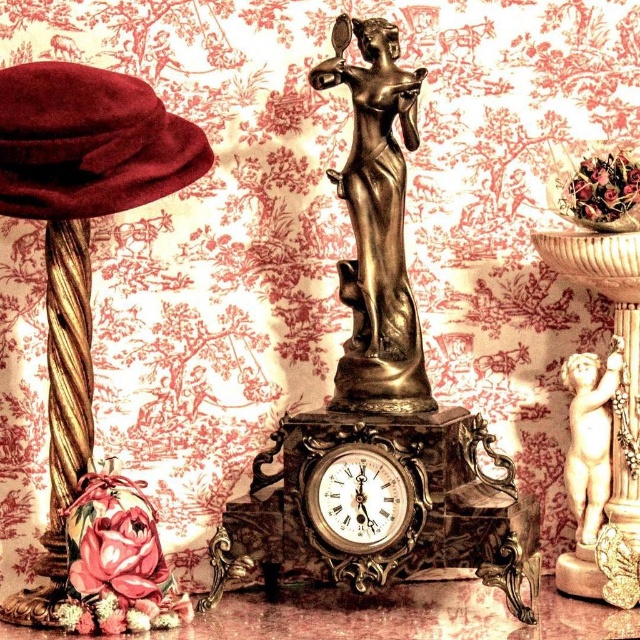
You are a decorator setting up a display. You have a velvet maroon hat at left and an ornate clock in the center. The display area is 1.5 meters wide. Can both items fit side by side without overlapping?

The velvet maroon hat at left and the ornate clock in the center are 1.38 meters apart, so yes, they can fit side by side within the 1.5 meter wide display area since the distance between them is less than the total width available.